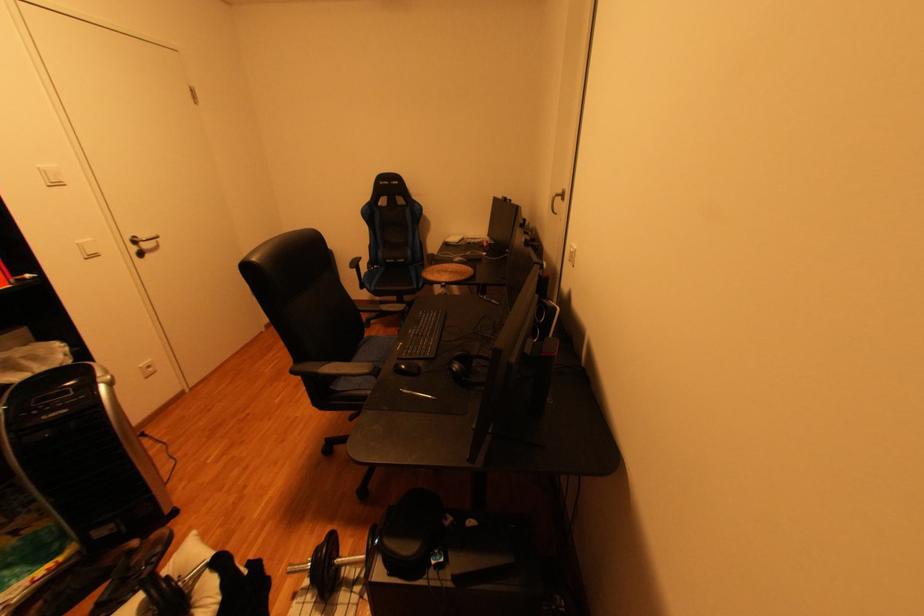
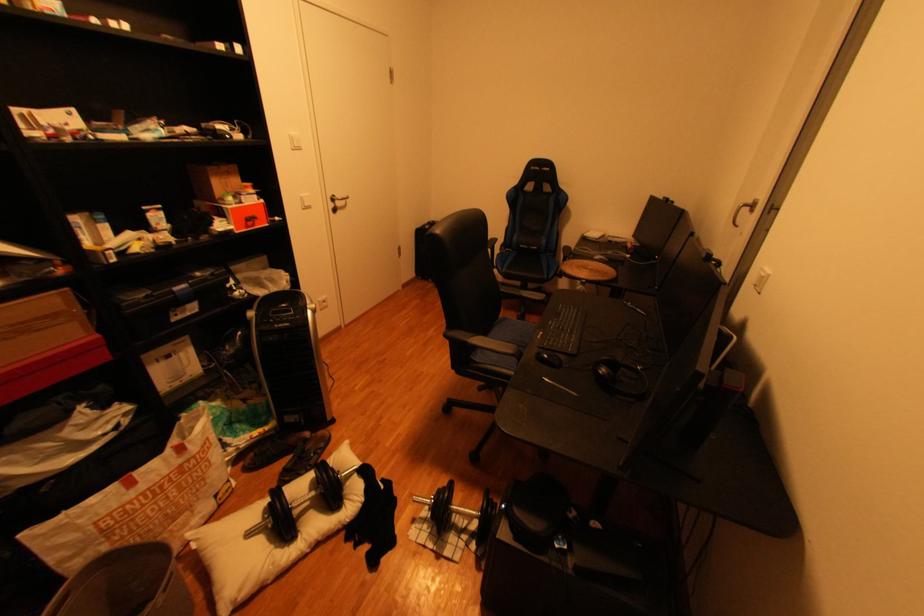
Find the pixel in the second image that matches (x=397, y=262) in the first image.

(531, 246)